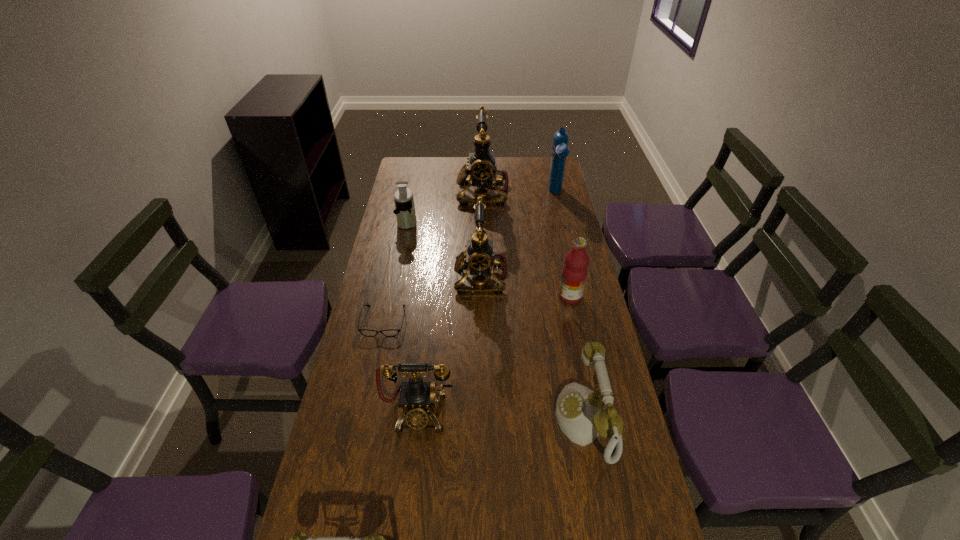
I want to click on the tallest object, so click(x=483, y=172).

Where is `the tallest telephone`? The image size is (960, 540). the tallest telephone is located at coordinates (483, 172).

In order to click on shampoo in this screenshot , I will do `click(560, 150)`.

Find the location of a particular element. The width and height of the screenshot is (960, 540). the fourth nearest telephone is located at coordinates [479, 257].

This screenshot has height=540, width=960. In order to click on the second nearest black telephone in this screenshot , I will do [x=479, y=257].

You are a GUI agent. You are given a task and a screenshot of the screen. Output one action in this format:
    pyautogui.click(x=<x>, y=<y>)
    Task: Click on the fruit juice
    This screenshot has height=540, width=960.
    Given the screenshot: What is the action you would take?
    pyautogui.click(x=574, y=272)

Locate an element on the screen. the nearest black telephone is located at coordinates (417, 400).

What are the coordinates of `juicer` in the screenshot? It's located at (405, 212).

Locate an element on the screen. This screenshot has width=960, height=540. the farther white telephone is located at coordinates (581, 414).

The image size is (960, 540). What are the coordinates of `the right white telephone` in the screenshot? It's located at (581, 414).